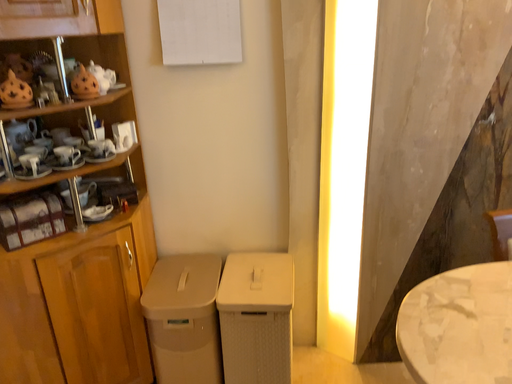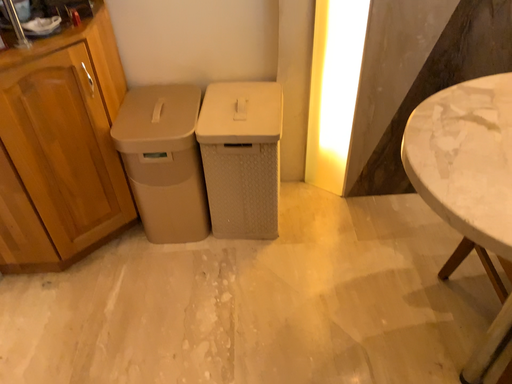
Question: How did the camera likely rotate when shooting the video?

Choices:
 (A) rotated upward
 (B) rotated downward

Answer: (B)